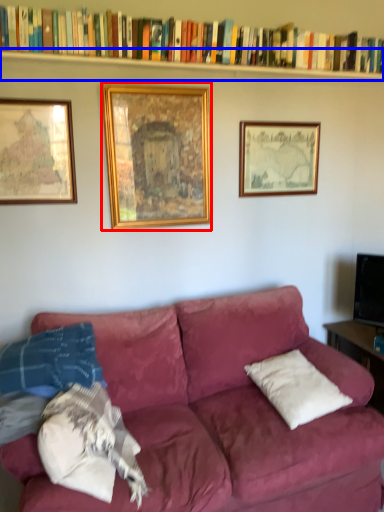
Question: Which point is closer to the camera, picture frame (highlighted by a red box) or shelf (highlighted by a blue box)?

Choices:
 (A) picture frame
 (B) shelf

Answer: (B)